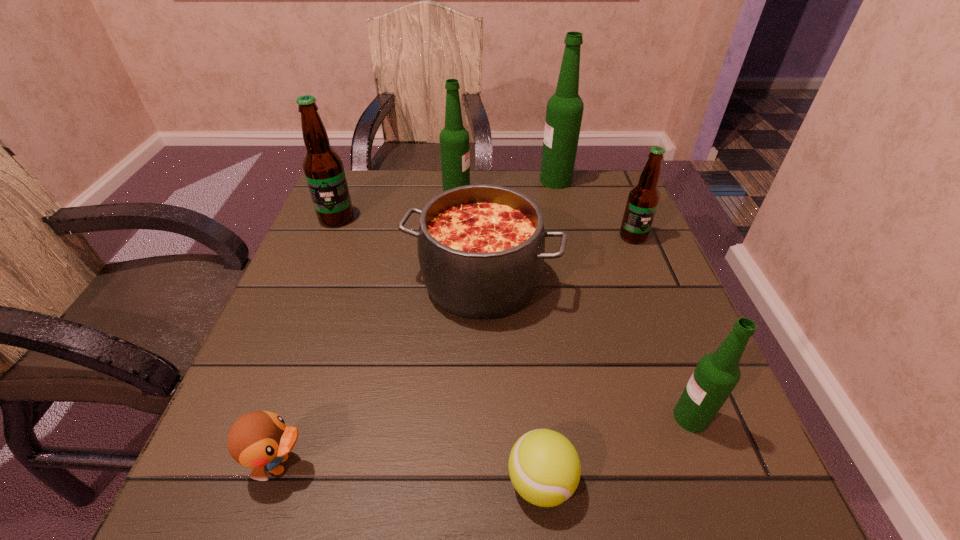
The width and height of the screenshot is (960, 540). I want to click on the sixth tallest object, so click(x=481, y=248).

Find the location of `the seventh tallest object`. the seventh tallest object is located at coordinates (260, 440).

This screenshot has width=960, height=540. I want to click on duck, so coord(260,440).

Where is `green tennis ball`? green tennis ball is located at coordinates (544, 467).

Identify the location of tennis ball. [544, 467].

I want to click on vacant area located on the label of the second green beer bottle from right to left, so click(468, 181).

Where is `free space located on the label of the second green beer bottle from right to left`? This screenshot has width=960, height=540. free space located on the label of the second green beer bottle from right to left is located at coordinates (396, 181).

In order to click on vacant space located on the label of the second green beer bottle from right to left in this screenshot , I will do `click(443, 181)`.

Where is `vacant space located on the label of the leftmost green beer bottle`? The width and height of the screenshot is (960, 540). vacant space located on the label of the leftmost green beer bottle is located at coordinates (527, 197).

This screenshot has height=540, width=960. I want to click on vacant point located on the label of the left brown beer bottle, so click(298, 315).